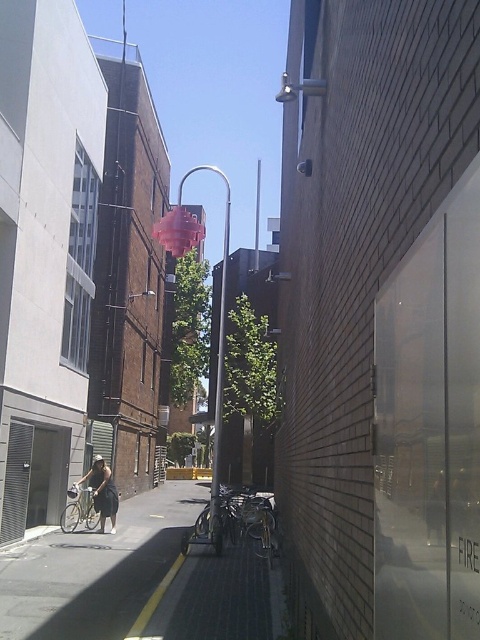
Is pink translucent lamp post at center positioned in front of silver metallic bicycle at lower left?

That is True.

Is point (222, 177) closer to viewer compared to point (75, 483)?

That is False.

Image resolution: width=480 pixels, height=640 pixels. I want to click on pink translucent lamp post at center, so click(x=217, y=333).

Who is taller, dark gray concrete pavement at center or pink translucent lamp post at center?

pink translucent lamp post at center

Who is more distant from viewer, (x=84, y=616) or (x=223, y=296)?

The point (x=223, y=296) is more distant.

Who is more distant from viewer, [124,630] or [228,200]?

Point [228,200]

Locate an element on the screen. dark gray concrete pavement at center is located at coordinates (96, 570).

Does dark gray concrete pavement at center appear under silver metallic bicycle at lower left?

Yes, dark gray concrete pavement at center is below silver metallic bicycle at lower left.

Does point (156, 634) come in front of point (69, 506)?

Yes, point (156, 634) is in front of point (69, 506).

Find the location of a particular element. The image size is (480, 640). dark gray concrete pavement at center is located at coordinates (96, 570).